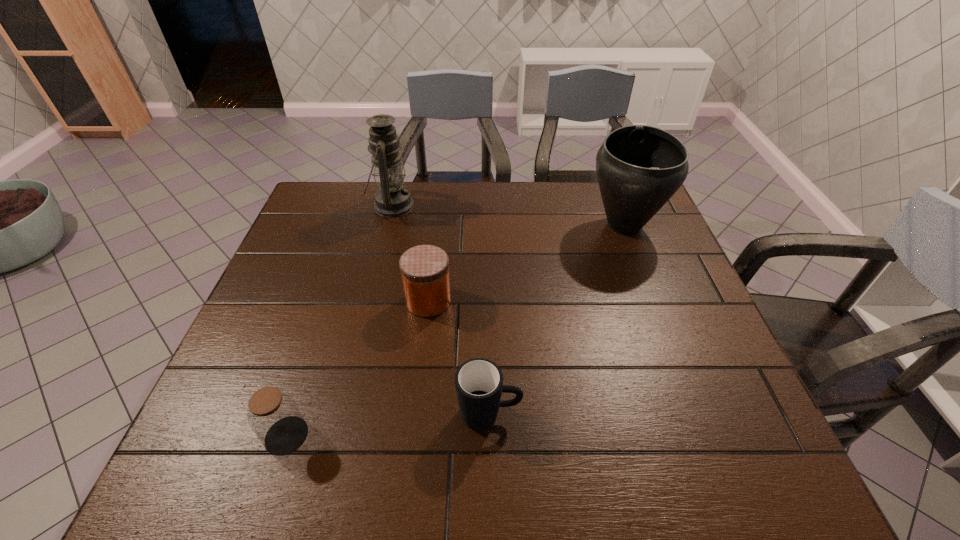
I want to click on vacant space at the left edge, so click(x=268, y=351).

Find the location of a particular element. The height and width of the screenshot is (540, 960). free space at the right edge of the desktop is located at coordinates (754, 433).

The image size is (960, 540). I want to click on vacant region at the near left corner of the desktop, so click(242, 442).

This screenshot has height=540, width=960. Find the location of `blank space at the far right corner`. blank space at the far right corner is located at coordinates (597, 184).

This screenshot has height=540, width=960. I want to click on free area in between the left jar and the rightmost object, so click(x=455, y=330).

At what (x,y) coordinates should I click in order to perform the action: click on free space that is in between the rightmost object and the right jar. Please return your answer as a coordinate pair (x, y). Looking at the image, I should click on (526, 263).

The image size is (960, 540). I want to click on free space between the oil lamp and the rightmost object, so click(x=508, y=216).

In order to click on vacant point located between the urn and the fourth object from left to right in this screenshot , I will do `click(557, 320)`.

Locate an element on the screen. The height and width of the screenshot is (540, 960). free space between the left jar and the second object from right to left is located at coordinates (388, 424).

Locate an element on the screen. This screenshot has height=540, width=960. free space between the mug and the third nearest object is located at coordinates (459, 357).